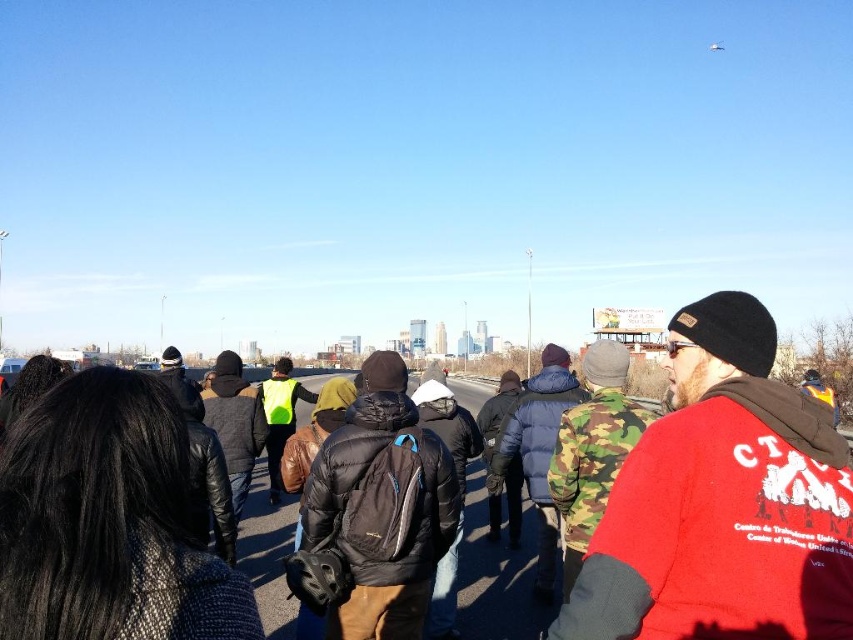
Question: Among these objects, which one is farthest from the camera?

Choices:
 (A) camo fabric jacket at center
 (B) red fleece jacket at center

Answer: (A)

Question: Can you confirm if black knit sweater at lower left is positioned to the left of black puffy jacket at center?

Choices:
 (A) yes
 (B) no

Answer: (A)

Question: Is red fleece jacket at center smaller than black knit sweater at lower left?

Choices:
 (A) no
 (B) yes

Answer: (A)

Question: Which object is positioned closest to the camo fabric jacket at center?

Choices:
 (A) black puffy jacket at center
 (B) black knit sweater at lower left

Answer: (A)

Question: Which point appears closest to the camera in this image?

Choices:
 (A) 88,442
 (B) 590,392

Answer: (A)

Question: Does red fleece jacket at center appear on the left side of black knit sweater at lower left?

Choices:
 (A) no
 (B) yes

Answer: (A)